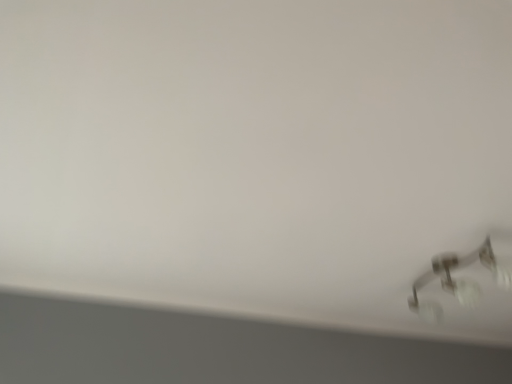
I want to click on satin nickel faucet at right, so click(458, 280).

What is the approximate height of satin nickel faucet at right?

8.47 inches.

Describe the element at coordinates (458, 280) in the screenshot. I see `satin nickel faucet at right` at that location.

In order to click on satin nickel faucet at right in this screenshot , I will do `click(458, 280)`.